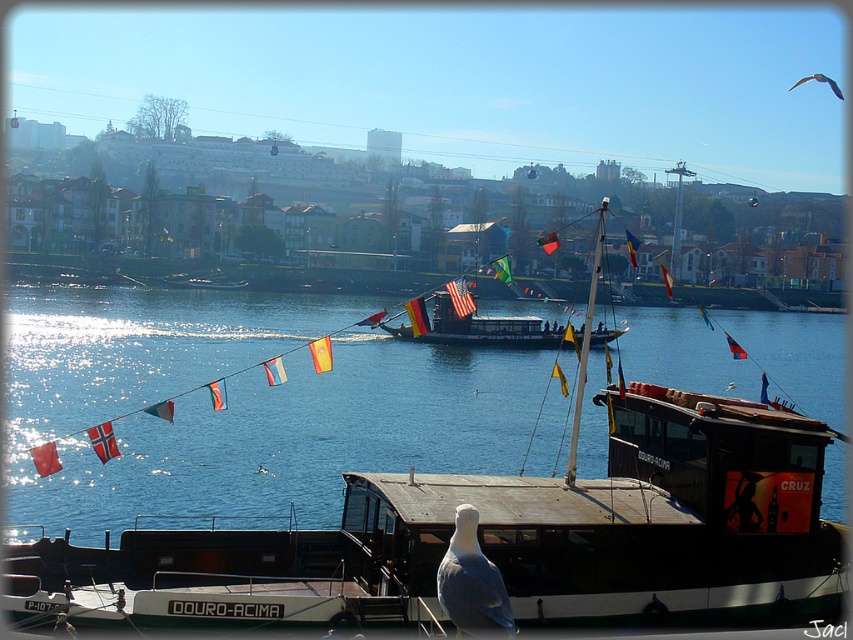
You are a tour guide on a boat and need to navigate between the wooden sailboat at center and the shiny black boat at center. The channel between them is 3.29 feet wide. If your tour boat is 3 feet wide, can you safely pass through the channel?

The channel between the wooden sailboat at center and the shiny black boat at center is 3.29 feet wide. Since your tour boat is 3 feet wide, there is enough space to safely pass through the channel with some clearance remaining.

From the picture: You are standing on the riverside and see the blue water at center and the white feathered bird at center. Which object is closer to you?

The white feathered bird at center is closer to you because the blue water at center is further away.